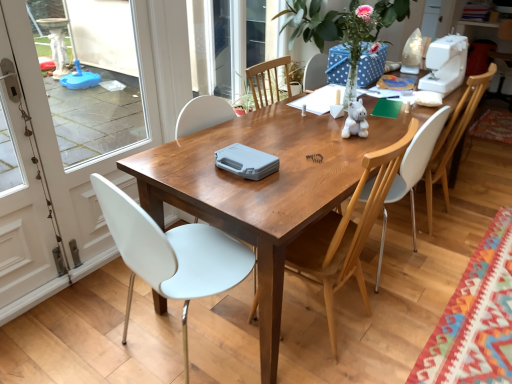
Identify the location of vacant area situated to the left side of white plastic sewing machine at upper right. Image resolution: width=512 pixels, height=384 pixels. (402, 88).